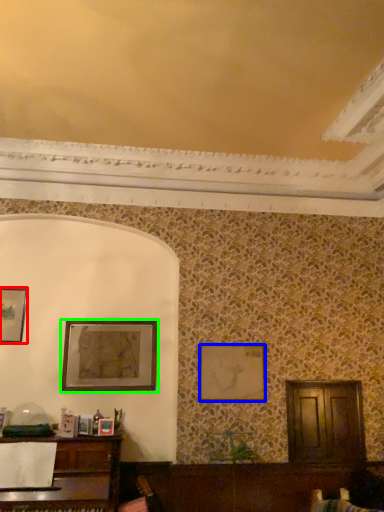
Question: Which object is the farthest from picture frame (highlighted by a red box)? Choose among these: picture frame (highlighted by a blue box) or picture frame (highlighted by a green box).

Choices:
 (A) picture frame
 (B) picture frame

Answer: (A)